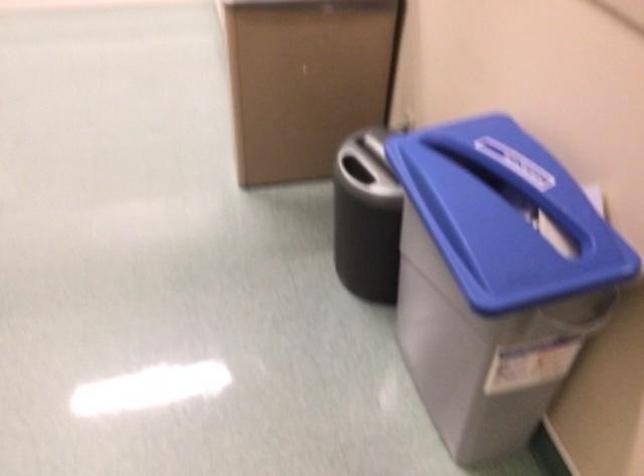
This screenshot has width=644, height=476. Identify the location of black trash can. (366, 217).